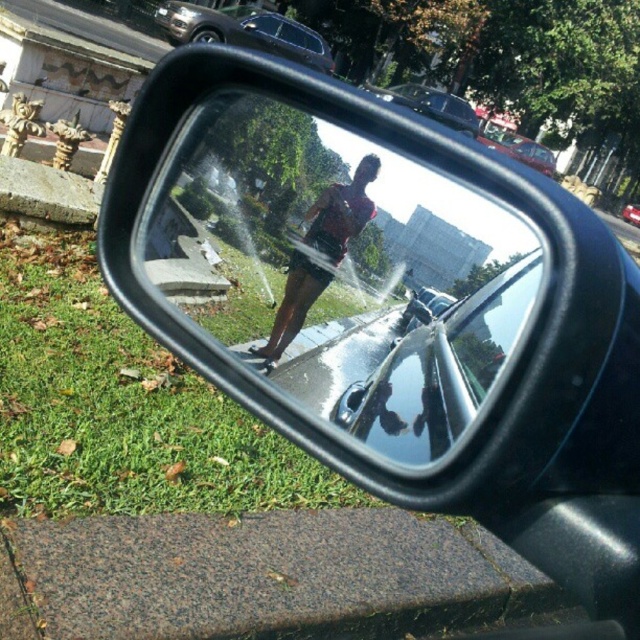
Which is above, transparent glass car window at center or shiny metallic car at center?

shiny metallic car at center is higher up.

Locate an element on the screen. The width and height of the screenshot is (640, 640). transparent glass car window at center is located at coordinates (490, 323).

Locate an element on the screen. This screenshot has width=640, height=640. transparent glass car window at center is located at coordinates (490, 323).

Can you confirm if matte black shorts at center is positioned above metallic silver car at upper center?

No.

Can you confirm if matte black shorts at center is positioned to the right of metallic silver car at upper center?

Correct, you'll find matte black shorts at center to the right of metallic silver car at upper center.

Image resolution: width=640 pixels, height=640 pixels. What are the coordinates of `matte black shorts at center` in the screenshot? It's located at (320, 252).

Is point (300, 371) more distant than point (429, 104)?

No, it is not.

Can you confirm if black glossy mirror at center is wider than metallic silver car at center?

No.

Where is `black glossy mirror at center`? The height and width of the screenshot is (640, 640). black glossy mirror at center is located at coordinates (340, 269).